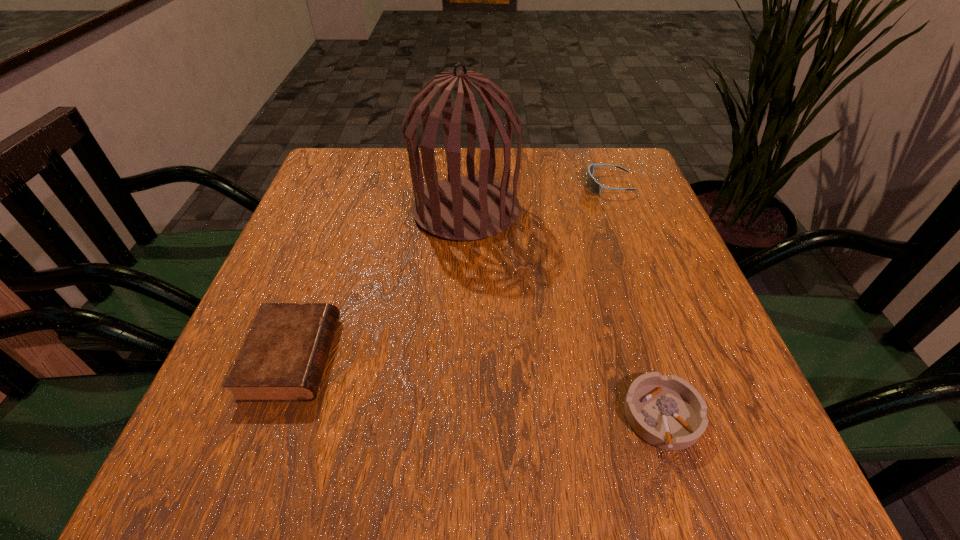
You are a GUI agent. You are given a task and a screenshot of the screen. Output one action in this format:
    pyautogui.click(x=<x>, y=<y>)
    Task: Click on the free region located on the left of the shortest object
    The width and height of the screenshot is (960, 540).
    Given the screenshot: What is the action you would take?
    pyautogui.click(x=538, y=417)

What are the coordinates of `birdcage present at the far edge` in the screenshot? It's located at (464, 208).

The height and width of the screenshot is (540, 960). I want to click on goggles that is at the far edge, so click(x=594, y=186).

The height and width of the screenshot is (540, 960). Identify the location of object at the near edge. (667, 412).

I want to click on object at the left edge, so click(x=283, y=357).

Locate an element on the screen. Image resolution: width=960 pixels, height=540 pixels. goggles that is at the right edge is located at coordinates (594, 186).

What are the coordinates of `ashtray present at the right edge` in the screenshot? It's located at (667, 412).

Identify the location of object located at the far right corner. click(x=594, y=186).

Locate an element on the screen. object that is at the near right corner is located at coordinates coord(667,412).

Locate an element on the screen. The width and height of the screenshot is (960, 540). free spot at the far edge of the desktop is located at coordinates (544, 157).